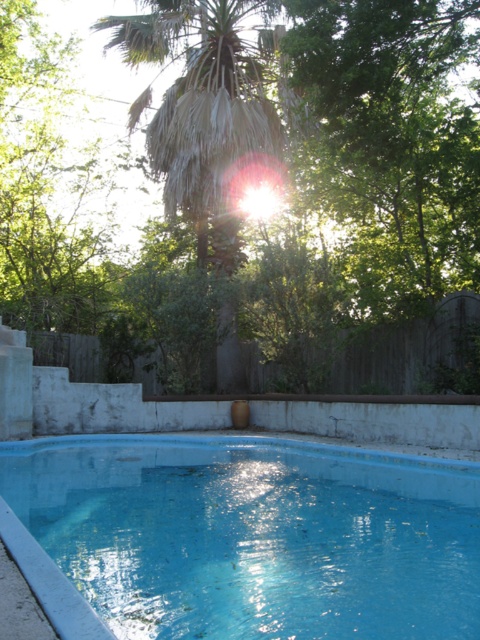
Based on the photo, you are standing in the backyard and want to take a photo of the blue painted concrete swimming pool at center. To avoid including the green leafy tree at upper center in your photo, which direction should you move relative to the pool?

The green leafy tree at upper center is to the left of the blue painted concrete swimming pool at center. To avoid including the tree in your photo, you should move to the right side of the pool.

You are standing in the backyard looking at the swimming pool. There are two points marked in the scene. The first point is at coordinates point (423, 305) and the second point is at point (472, 554). Which point is closer to you?

Point (472, 554) is closer to you because it is less further to the camera than point (423, 305).

You are standing in the backyard and want to take a photo of the green leafy tree at upper center. If your camera has a maximum zoom range of 10 meters, will you be able to capture the tree clearly without moving closer?

The green leafy tree at upper center is 10.70 meters away from camera. Since the camera can only zoom up to 10 meters, you won cannot capture the tree clearly without moving closer.